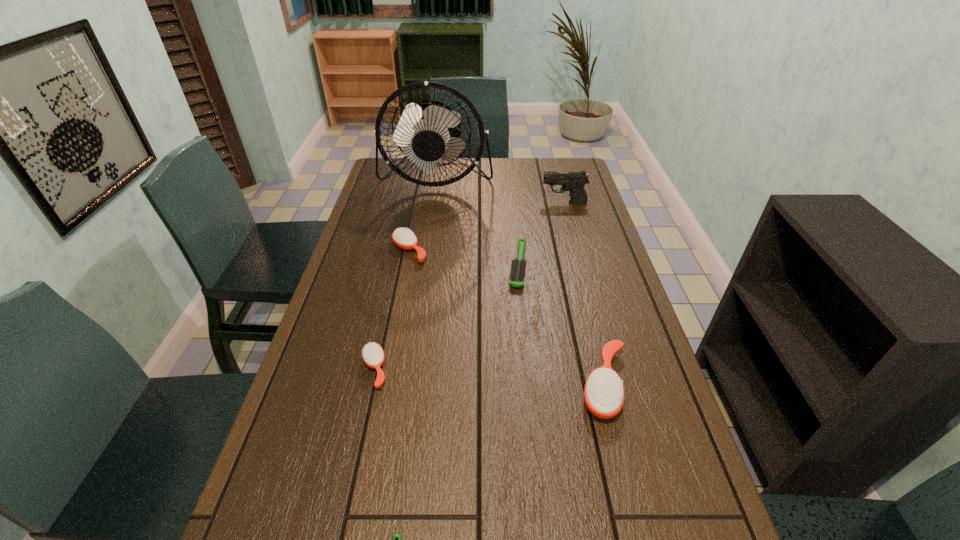
At what (x,y) coordinates should I click in order to perform the action: click on vacant space that is in between the second hairbrush from right to left and the fourth shortest hairbrush. Please return your answer as a coordinate pair (x, y). Looking at the image, I should click on (464, 259).

What are the coordinates of `free spot between the black fan and the smallest orange hairbrush` in the screenshot? It's located at (405, 273).

Locate an element on the screen. empty location between the sixth shortest object and the smallest orange hairbrush is located at coordinates (469, 286).

Identify which object is located as the second nearest to the sixth nearest object. Please provide its 2D coordinates. Your answer should be formatted as a tuple, i.e. [(x, y)], where the tuple contains the x and y coordinates of a point satisfying the conditions above.

[(517, 273)]

Identify which object is the sixth nearest to the smallest orange hairbrush. Please provide its 2D coordinates. Your answer should be formatted as a tuple, i.e. [(x, y)], where the tuple contains the x and y coordinates of a point satisfying the conditions above.

[(574, 182)]

Locate which hairbrush ranks in proximity to the bigger light hairbrush. Please provide its 2D coordinates. Your answer should be formatted as a tuple, i.e. [(x, y)], where the tuple contains the x and y coordinates of a point satisfying the conditions above.

[(604, 392)]

This screenshot has height=540, width=960. What are the coordinates of `hairbrush that can be found as the closest to the rightmost hairbrush` in the screenshot? It's located at (517, 273).

Select which orange hairbrush appears as the closest to the biggest orange hairbrush. Please provide its 2D coordinates. Your answer should be formatted as a tuple, i.e. [(x, y)], where the tuple contains the x and y coordinates of a point satisfying the conditions above.

[(373, 355)]

Choose which orange hairbrush is the nearest neighbor to the tallest hairbrush. Please provide its 2D coordinates. Your answer should be formatted as a tuple, i.e. [(x, y)], where the tuple contains the x and y coordinates of a point satisfying the conditions above.

[(373, 355)]

Find the location of a particular element. The width and height of the screenshot is (960, 540). light hairbrush that stands as the second closest to the farthest orange hairbrush is located at coordinates (397, 538).